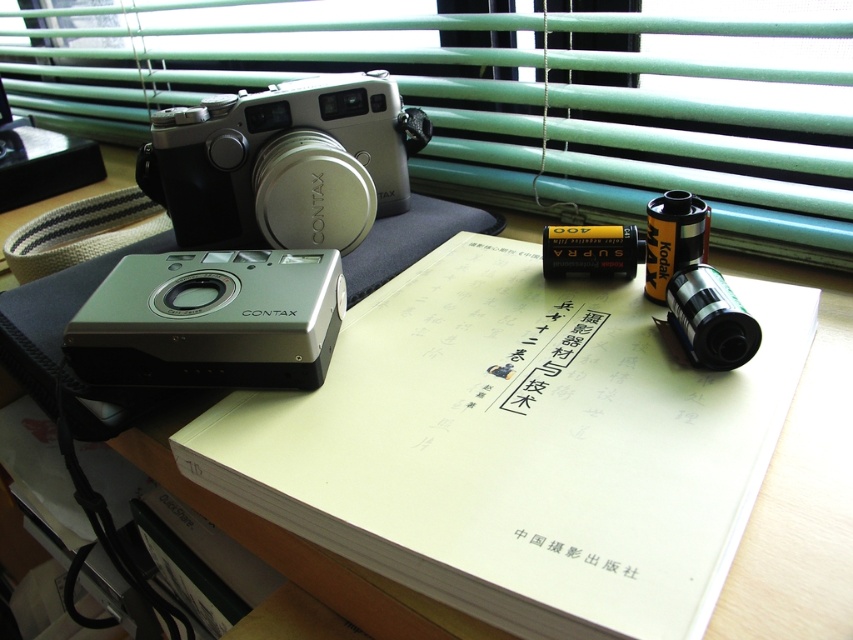
Is green matte blinds at upper center in front of silver metallic camera at lower left?

That is False.

Is green matte blinds at upper center behind silver metallic camera at lower left?

Yes, green matte blinds at upper center is further from the viewer.

Which is in front, point (109, 138) or point (309, 353)?

Point (309, 353)

Where is `green matte blinds at upper center`? This screenshot has height=640, width=853. green matte blinds at upper center is located at coordinates (503, 97).

Does green matte blinds at upper center appear on the right side of silver metallic camera at upper left?

No, green matte blinds at upper center is not to the right of silver metallic camera at upper left.

The width and height of the screenshot is (853, 640). Find the location of `green matte blinds at upper center`. green matte blinds at upper center is located at coordinates (503, 97).

Which is in front, point (846, 205) or point (202, 145)?

Point (846, 205) is in front.

I want to click on green matte blinds at upper center, so click(x=503, y=97).

Which is below, silver metallic camera at upper left or silver metallic camera at lower left?

A: silver metallic camera at lower left is lower down.

From the picture: Is silver metallic camera at upper left smaller than silver metallic camera at lower left?

Incorrect, silver metallic camera at upper left is not smaller in size than silver metallic camera at lower left.

Where is `silver metallic camera at upper left`? The width and height of the screenshot is (853, 640). silver metallic camera at upper left is located at coordinates (283, 163).

Identify the location of silver metallic camera at upper left. Image resolution: width=853 pixels, height=640 pixels. (283, 163).